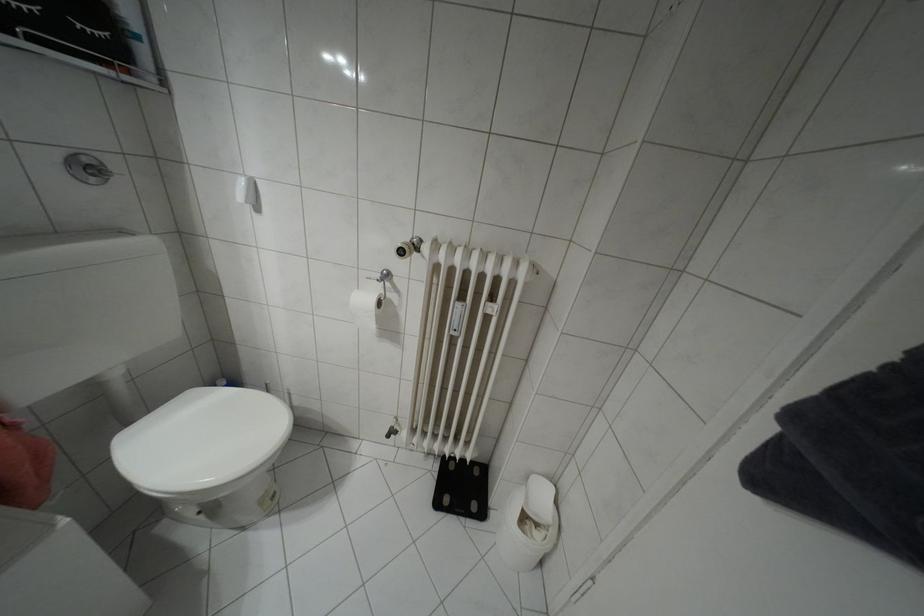
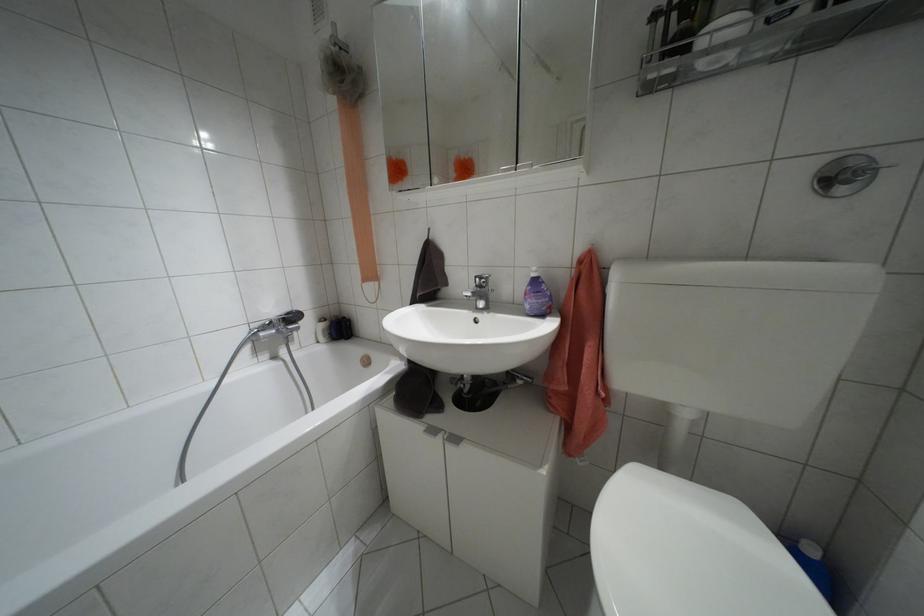
Locate, in the second image, the point that corresponds to (x=92, y=179) in the first image.

(841, 190)